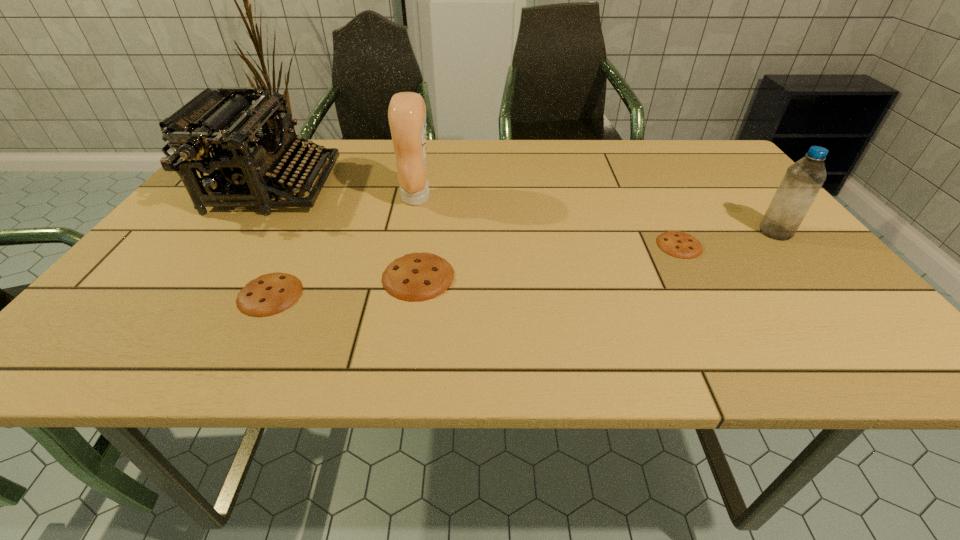
This screenshot has height=540, width=960. I want to click on free space located 0.390m on the back of the tallest cookie, so click(435, 168).

Locate an element on the screen. vacant space located on the left of the shortest cookie is located at coordinates (582, 245).

Where is `free location located 0.050m on the typing side of the typewriter`? Image resolution: width=960 pixels, height=540 pixels. free location located 0.050m on the typing side of the typewriter is located at coordinates (348, 187).

The height and width of the screenshot is (540, 960). I want to click on free space located 0.380m on the back of the water bottle, so click(708, 151).

This screenshot has height=540, width=960. Find the location of `blank area located on the label of the condiment`. blank area located on the label of the condiment is located at coordinates (529, 198).

The width and height of the screenshot is (960, 540). What are the coordinates of `object present at the far edge` in the screenshot? It's located at (226, 119).

This screenshot has height=540, width=960. Identify the location of object that is at the left edge. (226, 119).

Find the location of `object situated at the right edge`. object situated at the right edge is located at coordinates (802, 181).

Where is `object located in the far left corner section of the desktop`? This screenshot has width=960, height=540. object located in the far left corner section of the desktop is located at coordinates (226, 119).

This screenshot has height=540, width=960. In the image, there is a desktop. Identify the location of vacant area at the far edge. (484, 165).